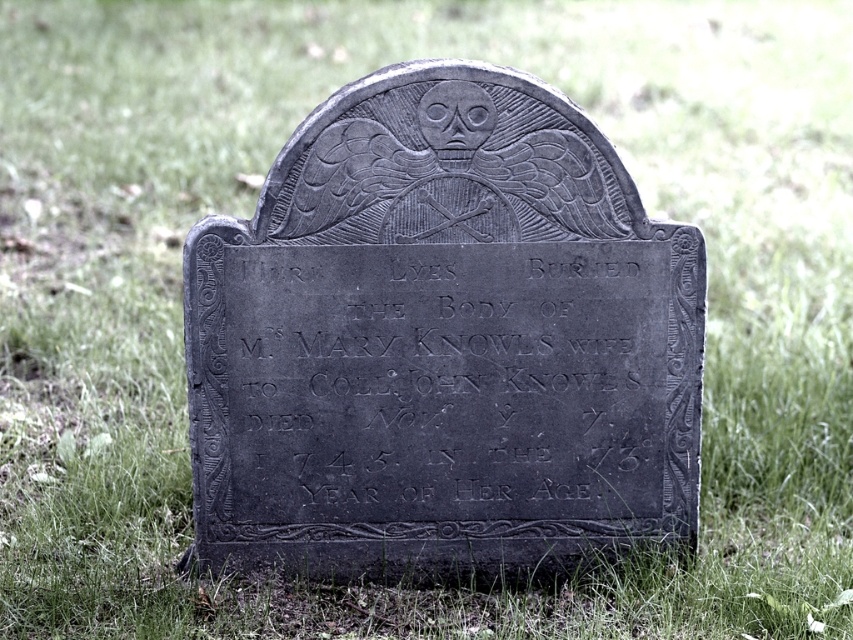
Can you confirm if black stone gravestone at center is bigger than black stone plaque at center?

Yes, black stone gravestone at center is bigger than black stone plaque at center.

Who is more distant from viewer, (576, 532) or (524, 353)?

The point (576, 532) is behind.

Locate an element on the screen. black stone gravestone at center is located at coordinates (442, 340).